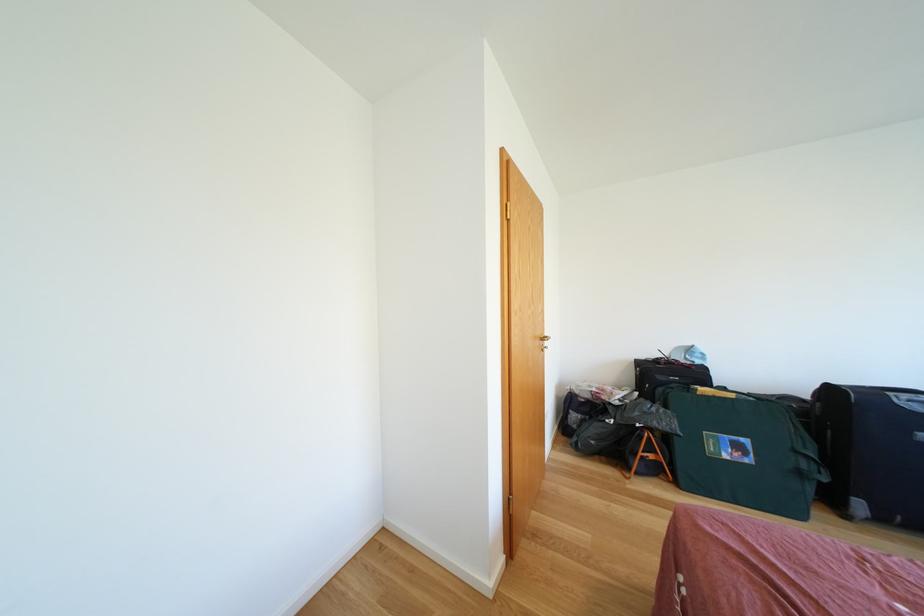
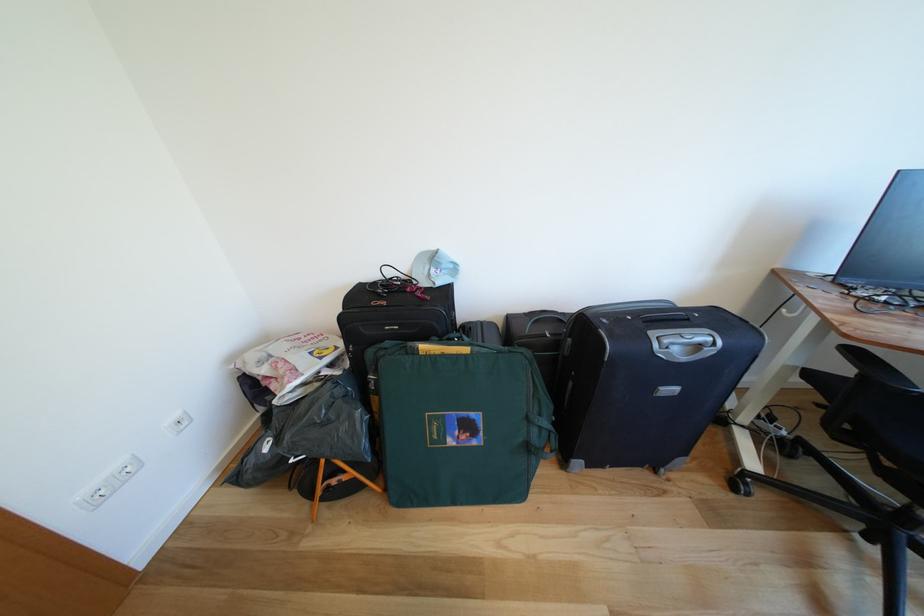
Question: I am providing you with two images of the same scene from different viewpoints. Please identify which objects are invisible in image2.

Choices:
 (A) green bag handle
 (B) black suitcase handle
 (C) white wall outlet
 (D) none of these

Answer: (D)